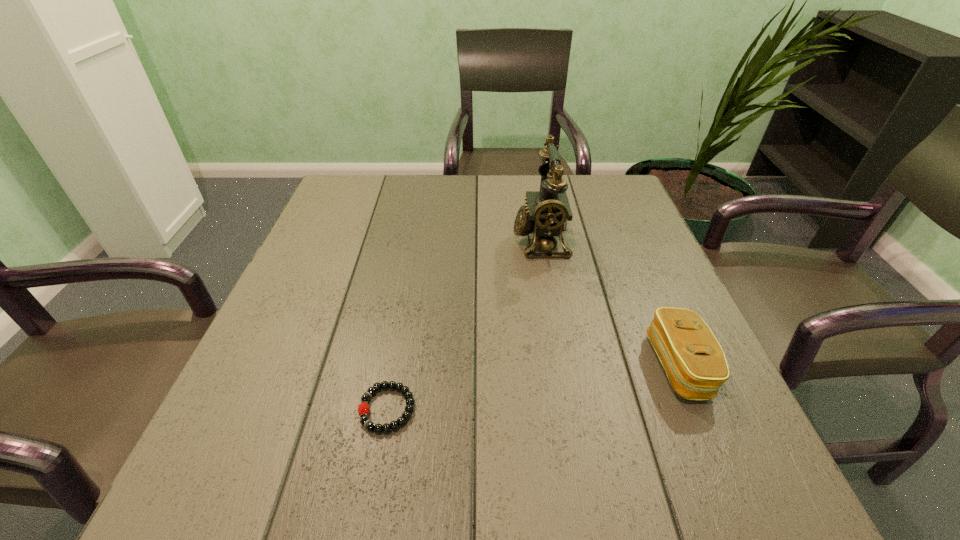
Locate an element on the screen. The height and width of the screenshot is (540, 960). free space between the shortest object and the telephone is located at coordinates (464, 325).

Identify which object is the nearest to the tallest object. Please provide its 2D coordinates. Your answer should be formatted as a tuple, i.e. [(x, y)], where the tuple contains the x and y coordinates of a point satisfying the conditions above.

[(694, 361)]

Locate an element on the screen. This screenshot has width=960, height=540. the closest object relative to the rightmost object is located at coordinates (547, 212).